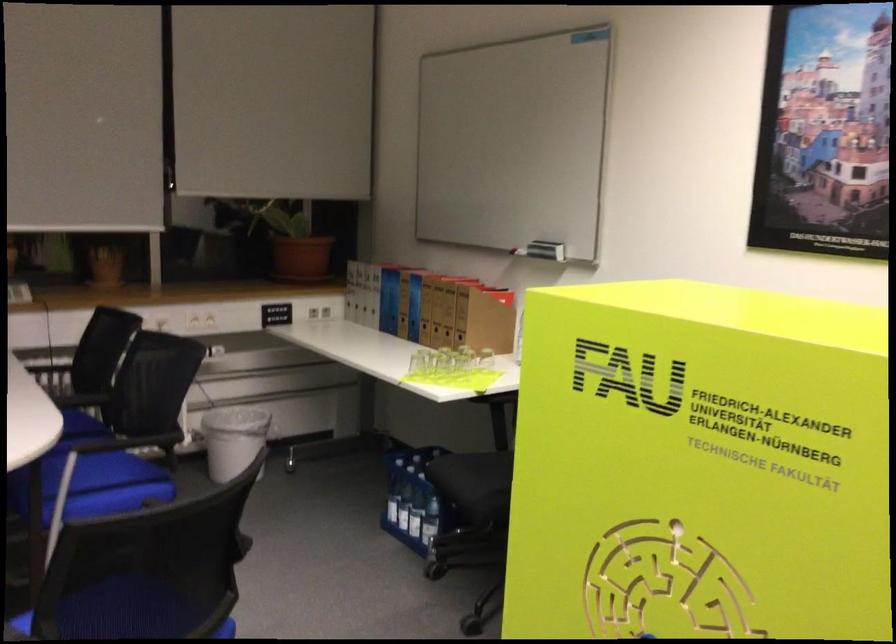
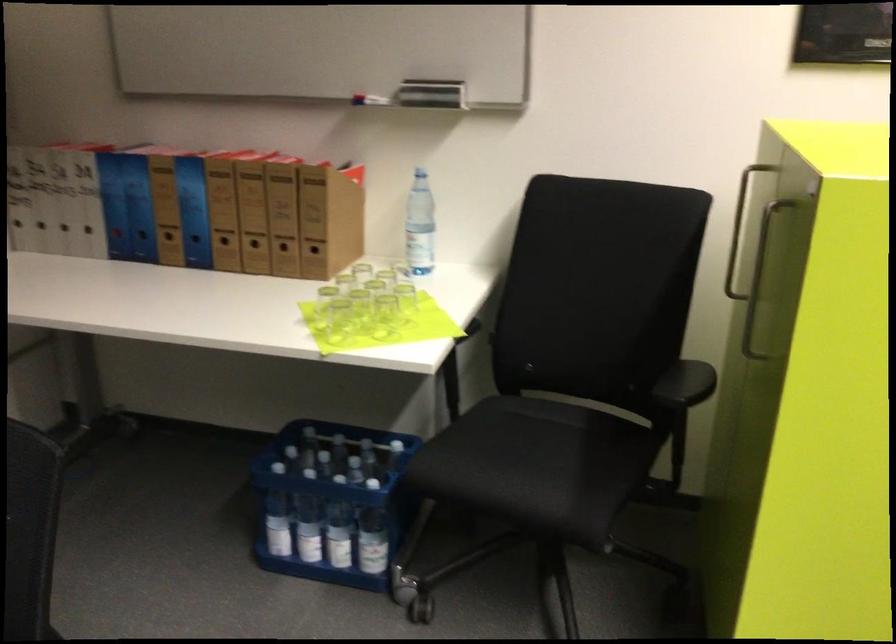
Where in the second image is the point corresponding to pixel 485 371 from the first image?

(405, 299)